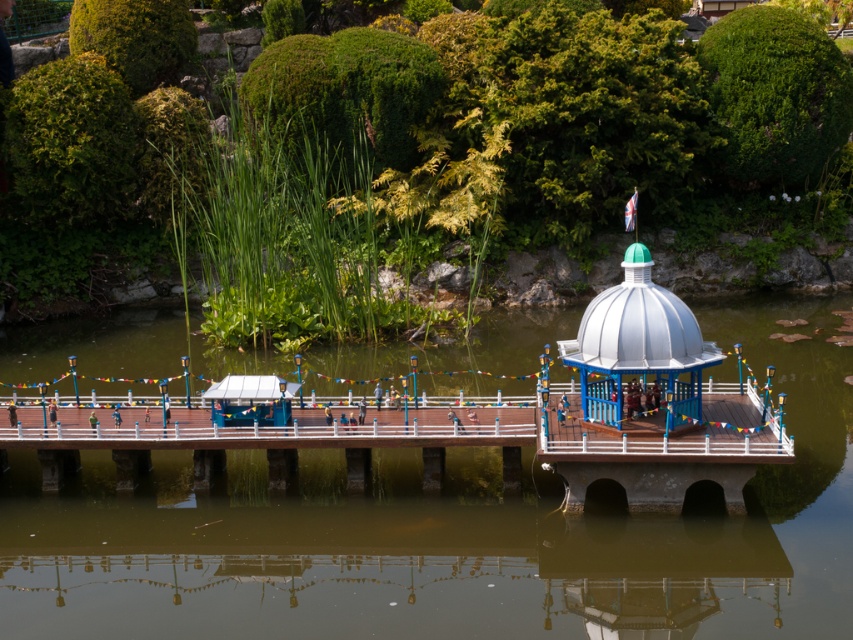
Question: From the image, what is the correct spatial relationship of white glossy gazebo at upper right in relation to white glossy dome at center?

Choices:
 (A) below
 (B) above

Answer: (A)

Question: Which of the following is the farthest from the observer?

Choices:
 (A) (592, 352)
 (B) (544, 406)

Answer: (B)

Question: Is white glossy gazebo at upper right below white glossy dome at center?

Choices:
 (A) yes
 (B) no

Answer: (A)

Question: Which point is closer to the camera?

Choices:
 (A) white glossy gazebo at upper right
 (B) white glossy dome at center

Answer: (A)

Question: In this image, where is white glossy gazebo at upper right located relative to white glossy dome at center?

Choices:
 (A) below
 (B) above

Answer: (A)